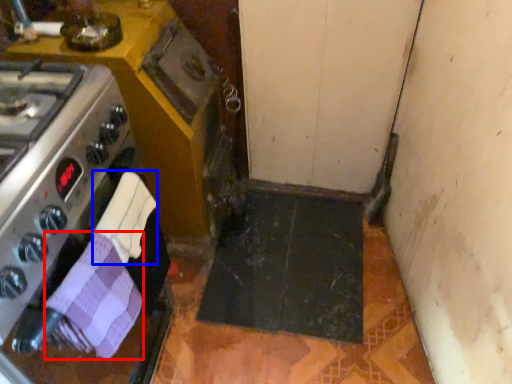
Question: Which point is closer to the camera, hand towel (highlighted by a red box) or hand towel (highlighted by a blue box)?

Choices:
 (A) hand towel
 (B) hand towel

Answer: (A)